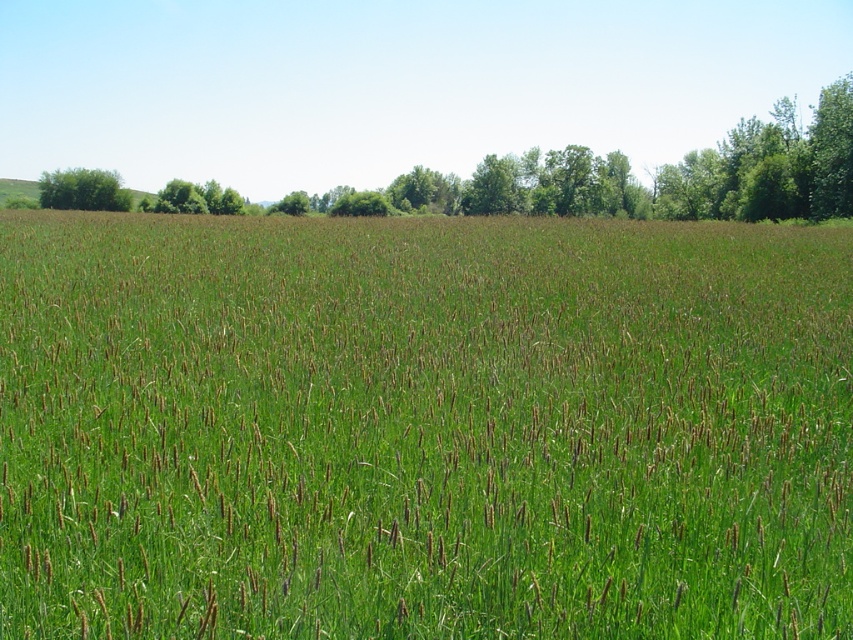
You are standing at the origin point of the image coordinate system. You want to walk to the green grassy field at center. In which direction should you move relative to your current position?

The green grassy field at center is located at coordinate point 0.669 on the x axis and 0.497 on the y axis. Since you are at the origin, you should move towards the right and slightly forward to reach it.

Looking at this image, you are standing in the middle of the green grassy field at center and want to walk towards the green leafy tree at upper left. Which direction should you head?

The green grassy field at center is to the right of the green leafy tree at upper left, so you should head to the left to reach the tree.

You are standing in the middle of the green grassy field at center and want to walk towards the green leafy tree at upper left. Which direction should you head to reach the tree?

The green leafy tree at upper left is located in the upper left direction from the green grassy field at center, so you should head towards the upper left to reach the tree.